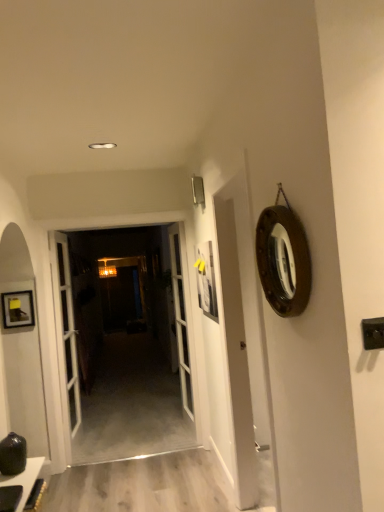
Question: Which direction should I rotate to face white glass door at center, which is counted as the 1th door, starting from the left, — up or down?

Choices:
 (A) down
 (B) up

Answer: (A)

Question: Does white glass door at center, acting as the 1th door starting from the right, have a greater height compared to matte black table at lower left?

Choices:
 (A) yes
 (B) no

Answer: (A)

Question: Is white glass door at center, acting as the 1th door starting from the right, positioned behind matte black table at lower left?

Choices:
 (A) no
 (B) yes

Answer: (B)

Question: Does white glass door at center, marked as the third door in a left-to-right arrangement, appear on the left side of matte black table at lower left?

Choices:
 (A) no
 (B) yes

Answer: (A)

Question: Can you confirm if white glass door at center, acting as the 1th door starting from the right, is thinner than matte black table at lower left?

Choices:
 (A) no
 (B) yes

Answer: (A)

Question: Does white glass door at center, acting as the 1th door starting from the right, touch matte black table at lower left?

Choices:
 (A) no
 (B) yes

Answer: (A)

Question: Is white glass door at center, acting as the 1th door starting from the right, facing away from matte black table at lower left?

Choices:
 (A) no
 (B) yes

Answer: (A)

Question: Is the position of white glass door at center, which is counted as the 1th door, starting from the left, less distant than that of white glass door at center, the 2th door in the left-to-right sequence?

Choices:
 (A) yes
 (B) no

Answer: (A)

Question: Does white glass door at center, the 3th door when ordered from right to left, appear on the left side of white glass door at center, the 2th door in the left-to-right sequence?

Choices:
 (A) no
 (B) yes

Answer: (B)

Question: Can you confirm if white glass door at center, the 3th door when ordered from right to left, is smaller than white glass door at center, which appears as the 2th door when viewed from the right?

Choices:
 (A) yes
 (B) no

Answer: (A)

Question: From the image's perspective, is white glass door at center, the 3th door when ordered from right to left, beneath white glass door at center, the 2th door in the left-to-right sequence?

Choices:
 (A) no
 (B) yes

Answer: (B)

Question: Is white glass door at center, which is counted as the 1th door, starting from the left, far from white glass door at center, which appears as the 2th door when viewed from the right?

Choices:
 (A) yes
 (B) no

Answer: (B)

Question: Does white glass door at center, which is counted as the 1th door, starting from the left, have a greater width compared to white glass door at center, the 2th door in the left-to-right sequence?

Choices:
 (A) yes
 (B) no

Answer: (A)

Question: Is white glass door at center, acting as the 1th door starting from the right, at the left side of white glass door at center, the 3th door when ordered from right to left?

Choices:
 (A) yes
 (B) no

Answer: (B)